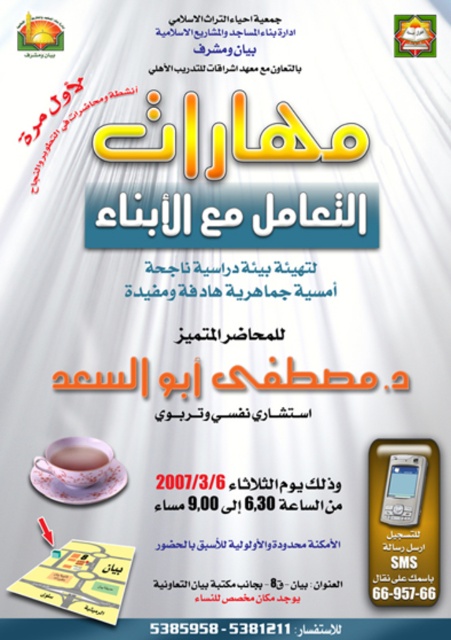
Question: Which point is farther to the camera?

Choices:
 (A) (79, 444)
 (B) (101, 451)

Answer: (A)

Question: Does matte paper map at lower center come behind matte plastic smartphone at center?

Choices:
 (A) no
 (B) yes

Answer: (A)

Question: Does metallic silver phone at bottom right have a lesser width compared to matte plastic smartphone at center?

Choices:
 (A) no
 (B) yes

Answer: (A)

Question: Can you confirm if matte paper map at lower center is wider than matte porcelain cup at center?

Choices:
 (A) no
 (B) yes

Answer: (B)

Question: Which of the following is the farthest from the observer?

Choices:
 (A) pink porcelain teacup at lower left
 (B) matte plastic smartphone at center

Answer: (A)

Question: Which point is farther to the camera?

Choices:
 (A) pink porcelain teacup at lower left
 (B) metallic silver phone at bottom right
 (C) matte porcelain cup at center

Answer: (C)